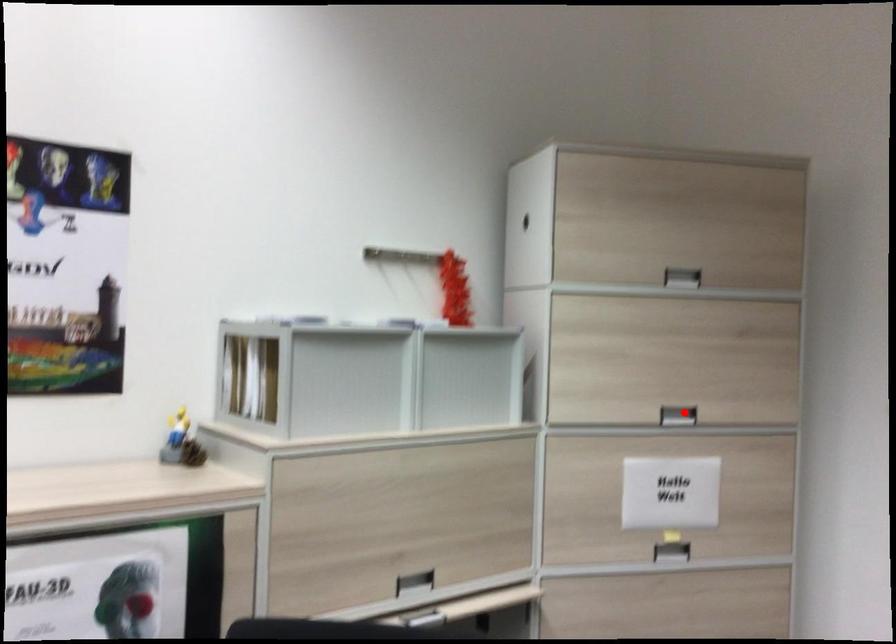
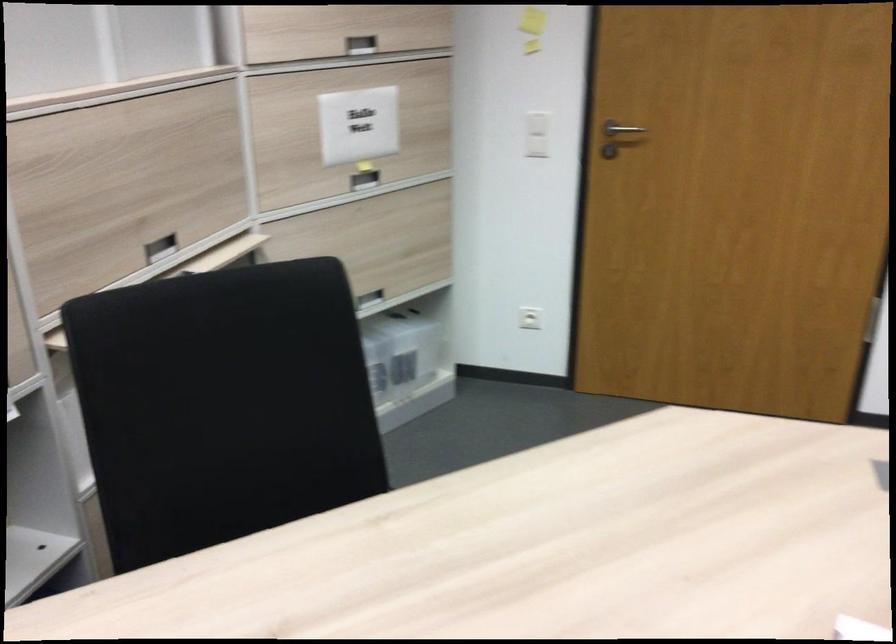
Locate, in the second image, the point that corresponds to the highlighted location in the first image.

(360, 44)